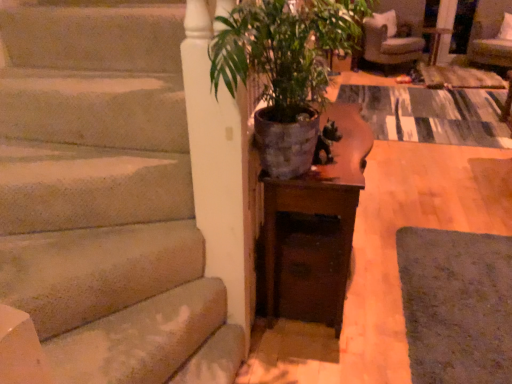
Question: From the image's perspective, is wooden table at center positioned above or below beige fabric armchair at upper right?

Choices:
 (A) above
 (B) below

Answer: (B)

Question: Visually, is wooden table at center positioned to the left or to the right of beige fabric armchair at upper right?

Choices:
 (A) right
 (B) left

Answer: (B)

Question: Estimate the real-world distances between objects in this image. Which object is closer to the wooden table at center?

Choices:
 (A) green matte pot at center
 (B) velvet beige armchair at upper right
 (C) wooden side table at center
 (D) beige fabric armchair at upper right

Answer: (A)

Question: Estimate the real-world distances between objects in this image. Which object is farther from the green matte pot at center?

Choices:
 (A) velvet beige armchair at upper right
 (B) wooden table at center
 (C) wooden side table at center
 (D) beige fabric armchair at upper right

Answer: (A)